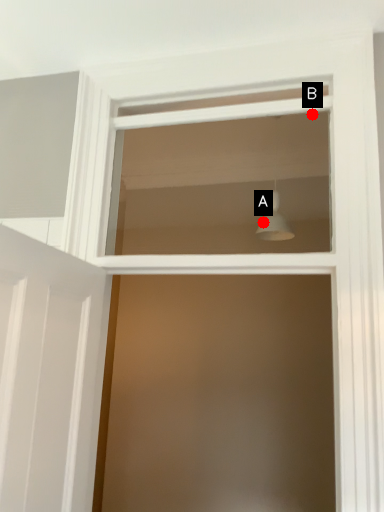
Question: Two points are circled on the image, labeled by A and B beside each circle. Which of the following is the closest to the observer?

Choices:
 (A) A is closer
 (B) B is closer

Answer: (B)